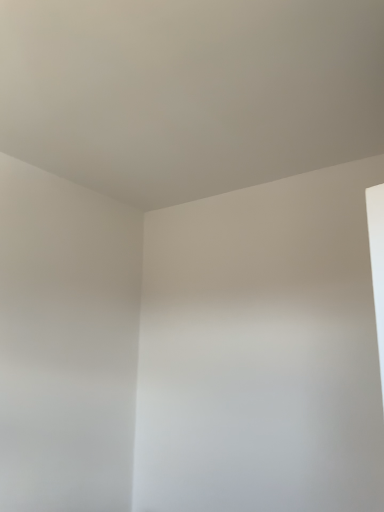
Image resolution: width=384 pixels, height=512 pixels. Identify the location of white matte wall at upper center. (189, 91).

The height and width of the screenshot is (512, 384). Describe the element at coordinates (189, 91) in the screenshot. I see `white matte wall at upper center` at that location.

This screenshot has height=512, width=384. Find the location of `white matte wall at upper center`. white matte wall at upper center is located at coordinates (189, 91).